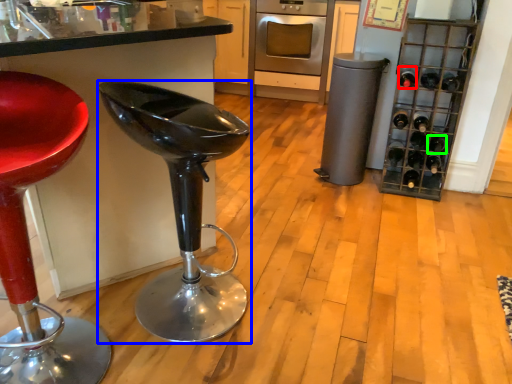
Question: Which object is positioned closest to wine bottle (highlighted by a red box)? Select from furniture (highlighted by a blue box) and wine bottle (highlighted by a green box).

Choices:
 (A) furniture
 (B) wine bottle

Answer: (B)